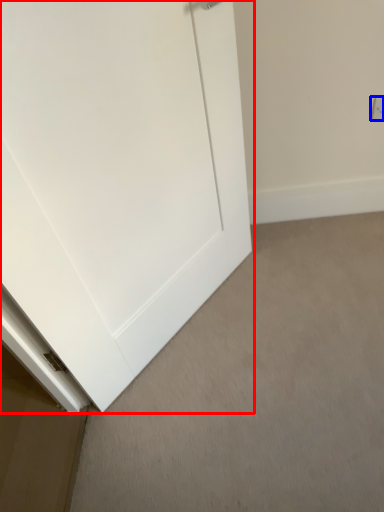
Question: Which of the following is the closest to the observer, door (highlighted by a red box) or electric outlet (highlighted by a blue box)?

Choices:
 (A) door
 (B) electric outlet

Answer: (A)